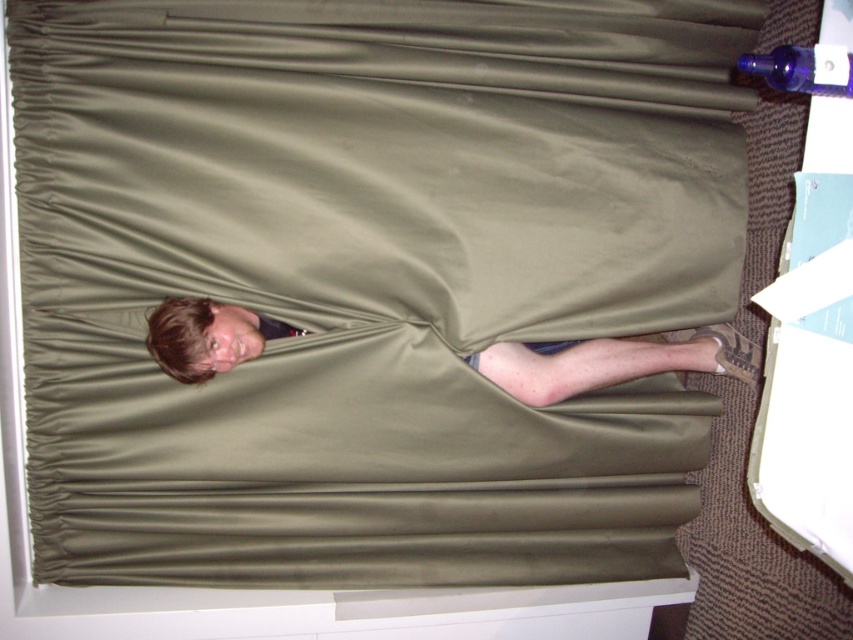
Question: Can you confirm if matte olive green fabric at lower center is positioned above transparent glass bottle at upper right?

Choices:
 (A) yes
 (B) no

Answer: (B)

Question: Where is matte olive green fabric at lower center located in relation to transparent glass bottle at upper right in the image?

Choices:
 (A) below
 (B) above

Answer: (A)

Question: Which of the following is the closest to the observer?

Choices:
 (A) (219, 368)
 (B) (759, 72)

Answer: (B)

Question: Which point is farther from the camera taking this photo?

Choices:
 (A) (575, 369)
 (B) (801, 84)

Answer: (A)

Question: Does matte olive green fabric at lower center have a smaller size compared to transparent glass bottle at upper right?

Choices:
 (A) no
 (B) yes

Answer: (A)